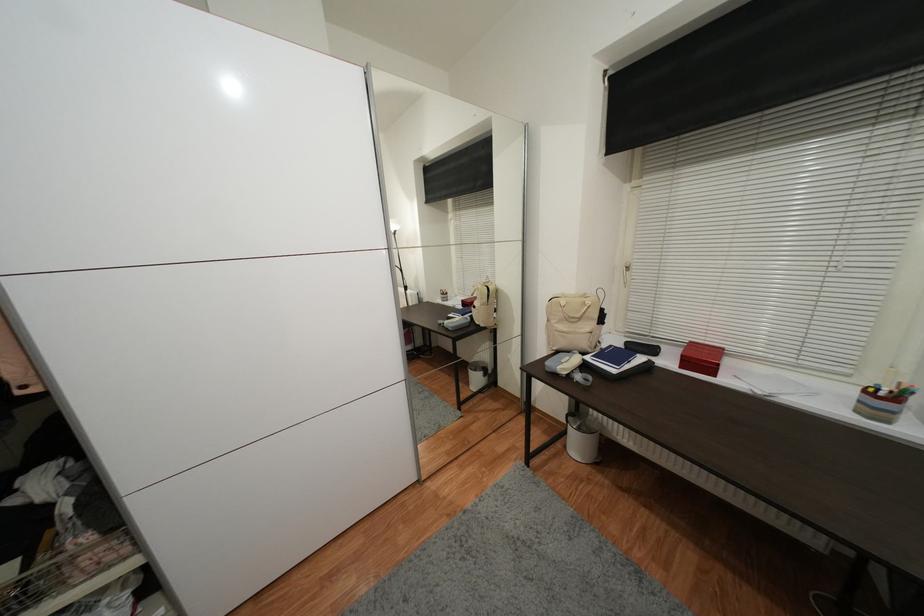
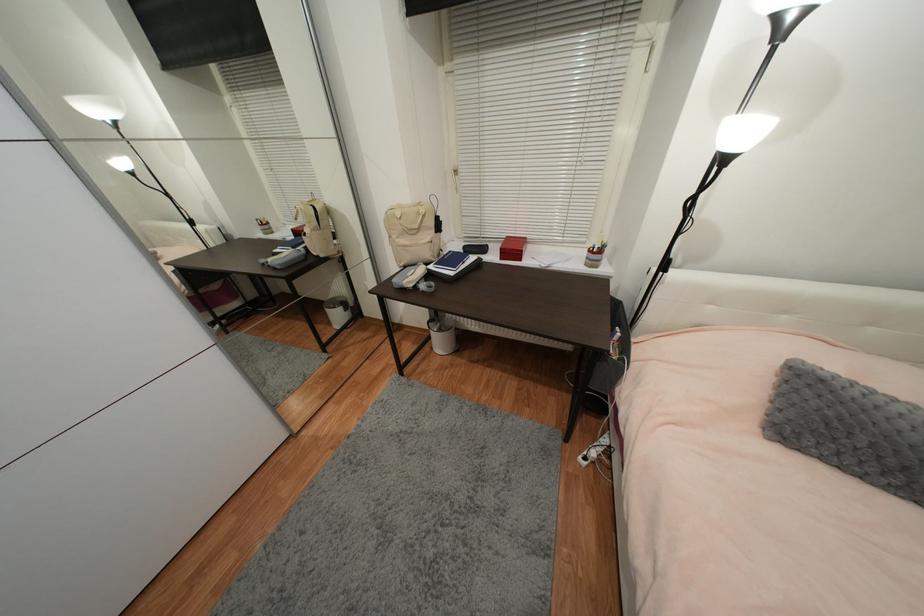
How did the camera likely rotate?

The rotation direction of the camera is right-down.